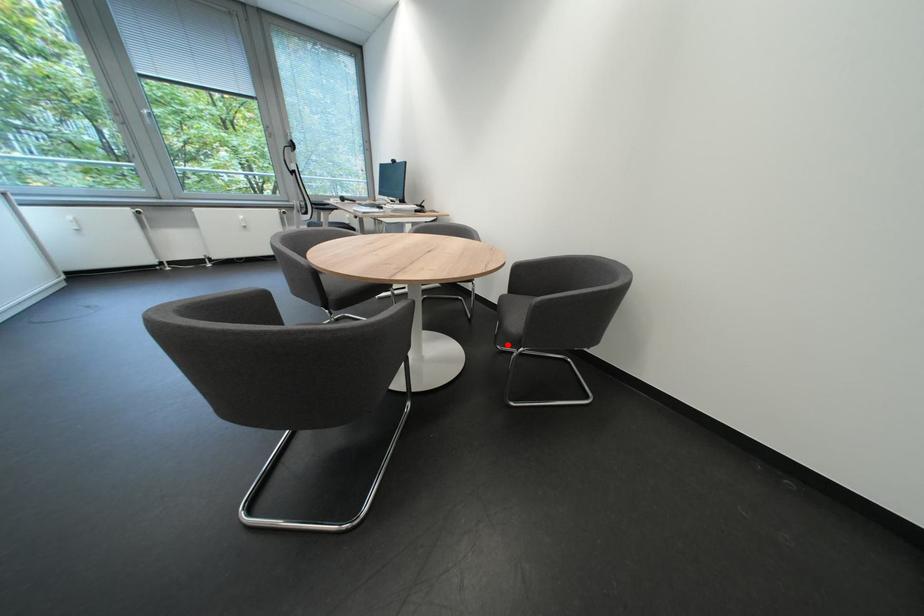
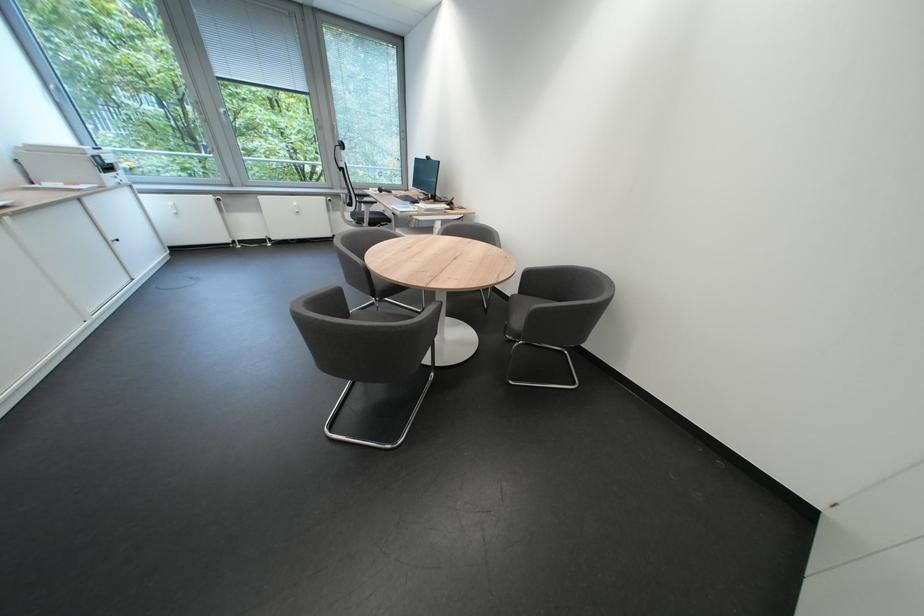
The point at the highlighted location is marked in the first image. Where is the corresponding point in the second image?

(517, 334)